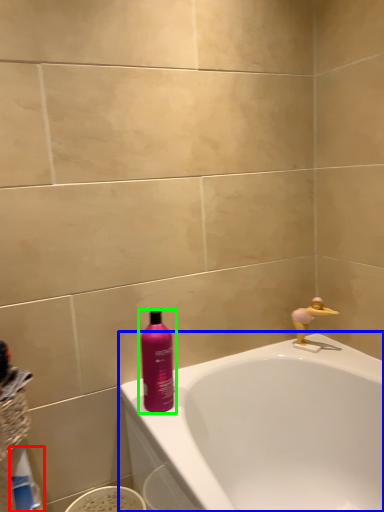
Question: Considering the real-world distances, which object is closest to cleaning product (highlighted by a red box)? bathtub (highlighted by a blue box) or bottle (highlighted by a green box).

Choices:
 (A) bathtub
 (B) bottle

Answer: (B)